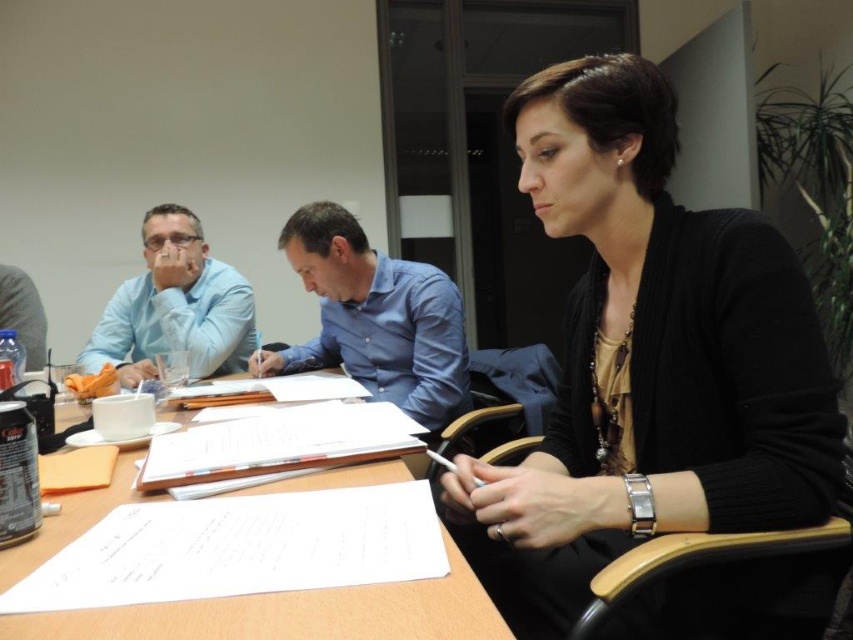
Is wooden table at center further to the viewer compared to matte blue shirt at left?

No.

Find the location of a particular element. Image resolution: width=853 pixels, height=640 pixels. wooden table at center is located at coordinates (294, 614).

Locate an element on the screen. The image size is (853, 640). wooden table at center is located at coordinates (294, 614).

What are the coordinates of `blue shirt at center` in the screenshot? It's located at (375, 317).

Does blue shirt at center appear over matte blue shirt at left?

Yes.

Who is more distant from viewer, (439, 332) or (108, 326)?

The point (108, 326) is more distant.

Locate an element on the screen. This screenshot has height=640, width=853. blue shirt at center is located at coordinates (375, 317).

Who is more forward, [701,246] or [57,481]?

Point [701,246] is more forward.

Is black matte cardigan at center above yellow paper at lower left?

Yes.

The width and height of the screenshot is (853, 640). Describe the element at coordinates (647, 360) in the screenshot. I see `black matte cardigan at center` at that location.

The width and height of the screenshot is (853, 640). I want to click on black matte cardigan at center, so click(x=647, y=360).